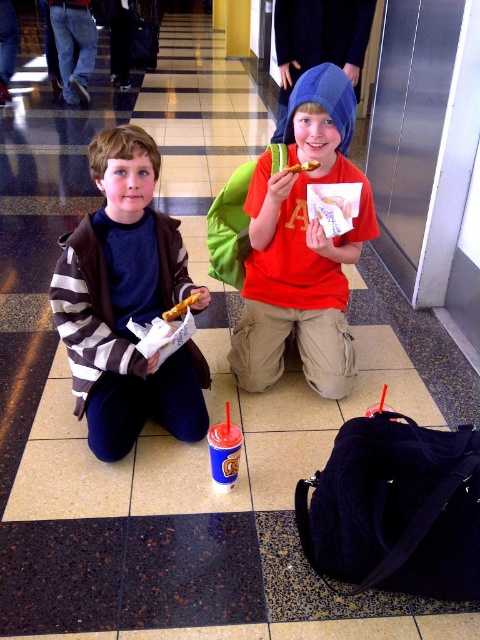
Question: Does golden crispy bread at center come behind yellow matte french fry at center?

Choices:
 (A) yes
 (B) no

Answer: (B)

Question: Is red matte shirt at center smaller than golden crispy bread at center?

Choices:
 (A) yes
 (B) no

Answer: (B)

Question: Which of these objects is positioned farthest from the striped fabric jacket at left?

Choices:
 (A) golden crispy bread at center
 (B) red matte shirt at center

Answer: (B)

Question: Does red matte shirt at center appear over yellow matte french fry at center?

Choices:
 (A) yes
 (B) no

Answer: (B)

Question: Which object is the farthest from the striped fabric jacket at left?

Choices:
 (A) golden crispy bread at center
 (B) yellow matte french fry at center
 (C) red matte shirt at center

Answer: (B)

Question: Estimate the real-world distances between objects in this image. Which object is farther from the striped fabric jacket at left?

Choices:
 (A) yellow matte french fry at center
 (B) golden crispy bread at center

Answer: (A)